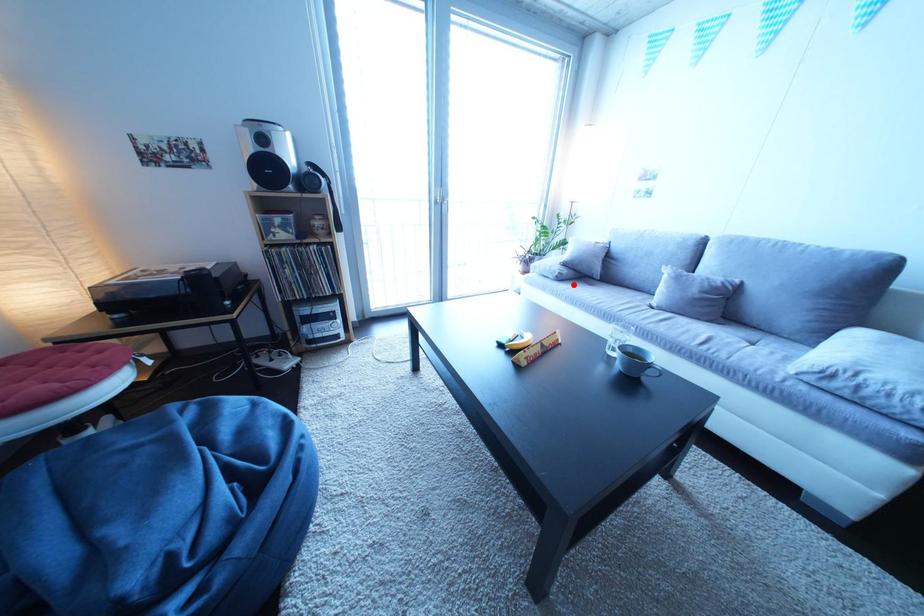
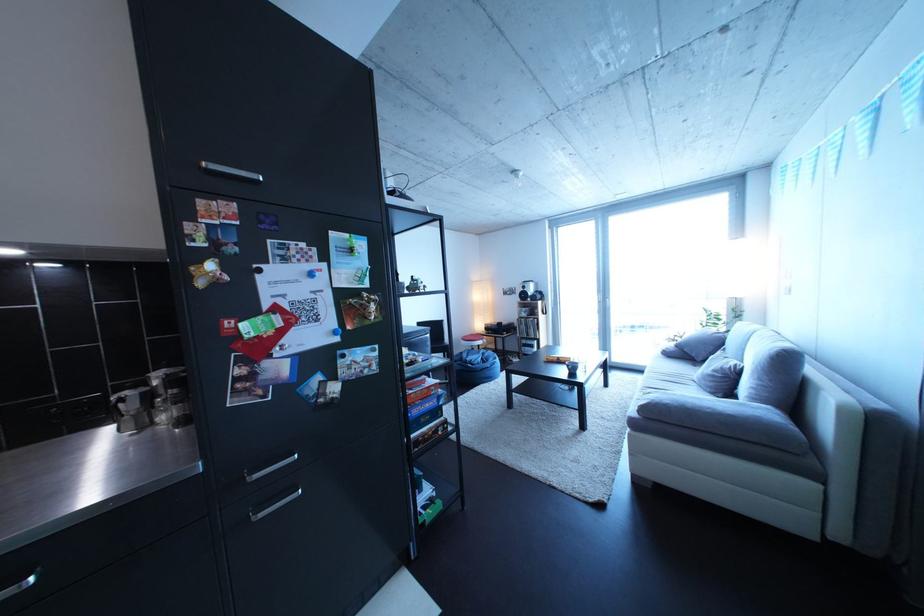
In the second image, find the point that corresponds to the highlighted location in the first image.

(682, 361)